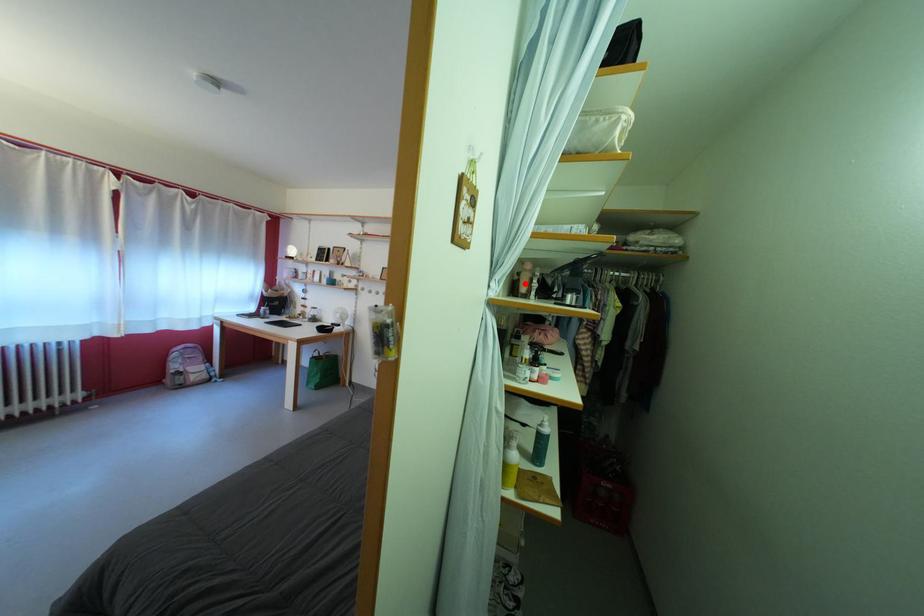
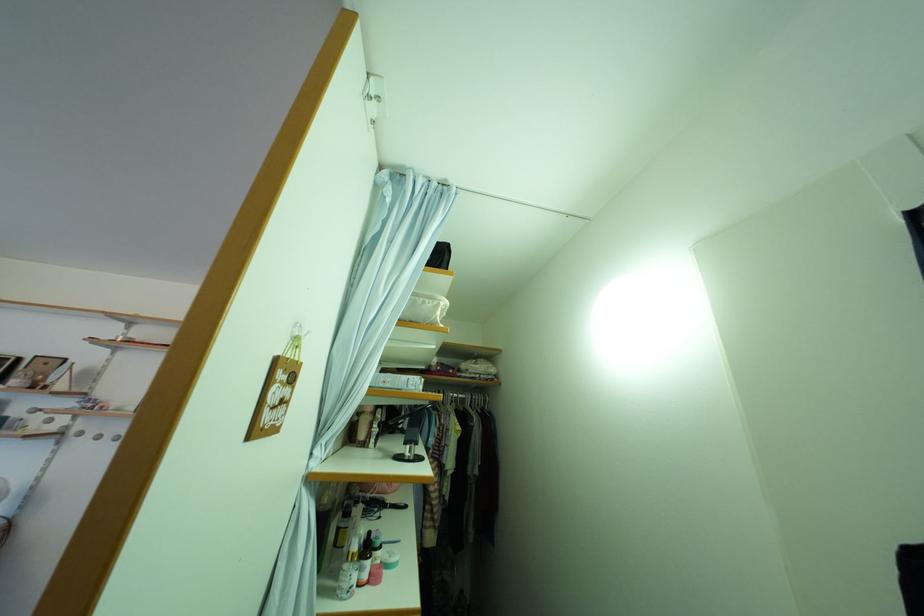
Find the pixel in the second image that matches the highlighted location in the first image.

(363, 424)